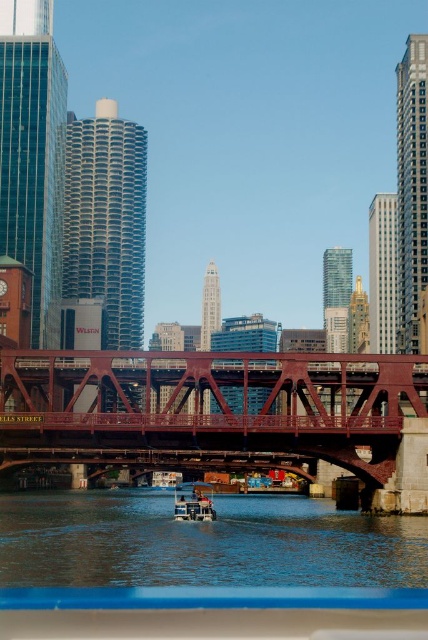
You are a tour boat captain navigating through the blue water at center. You need to pass under the red steel bridge at center. Based on the scene, will you have enough clearance to safely pass underneath the bridge?

The red steel bridge at center is positioned on the right side of blue water at center. Since the bridge spans over the water, there should be sufficient vertical clearance for the tour boat to pass underneath safely.

You are a tour boat captain planning to navigate your metallic blue boat at center under the red steel bridge at center. Based on the scene, can your boat pass through the bridge without any adjustments?

The red steel bridge at center is wider than the metallic blue boat at center, so the boat can pass through the bridge without any adjustments.

You are standing on the riverbank and want to take a photo of the red steel bridge at center and the blue water at center. Which object should you focus on first to ensure both are in frame?

You should focus on the red steel bridge at center first because it is closer to you than the blue water at center, ensuring both are in frame.